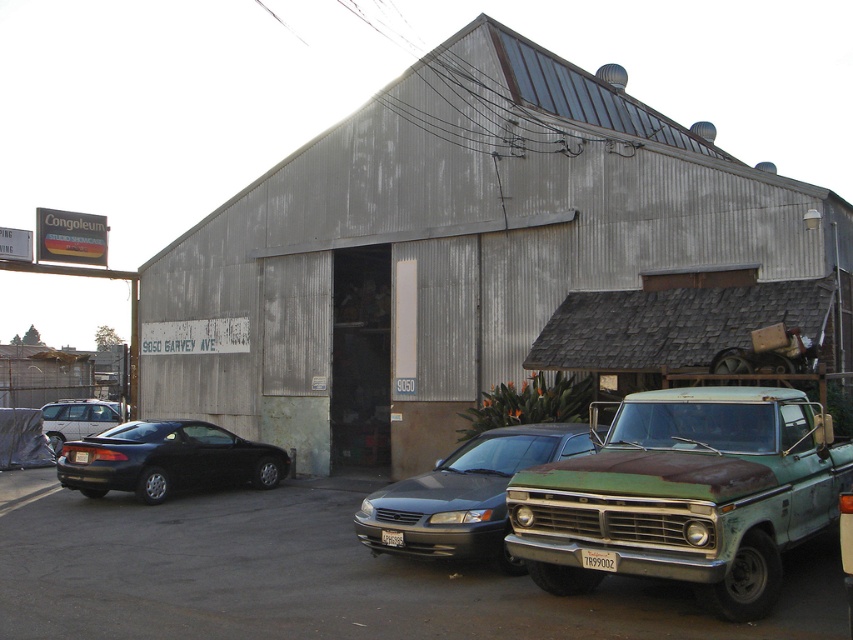
Measure the distance between rusty green pickup truck at lower right and matte black car at left.

rusty green pickup truck at lower right is 34.42 feet from matte black car at left.

From the picture: Does rusty green pickup truck at lower right appear under matte black car at left?

Actually, rusty green pickup truck at lower right is above matte black car at left.

Locate an element on the screen. The width and height of the screenshot is (853, 640). rusty green pickup truck at lower right is located at coordinates (683, 496).

Does point (709, 403) lie behind point (474, 540)?

No, (709, 403) is closer to viewer.

Does rusty green pickup truck at lower right have a lesser height compared to matte black sedan at center?

No.

Locate an element on the screen. rusty green pickup truck at lower right is located at coordinates (683, 496).

Consider the image. Between matte black sedan at center and matte black car at left, which one has less height?

With less height is matte black car at left.

Where is `matte black sedan at center`? matte black sedan at center is located at coordinates (463, 496).

Find the location of a particular element. The width and height of the screenshot is (853, 640). matte black sedan at center is located at coordinates (463, 496).